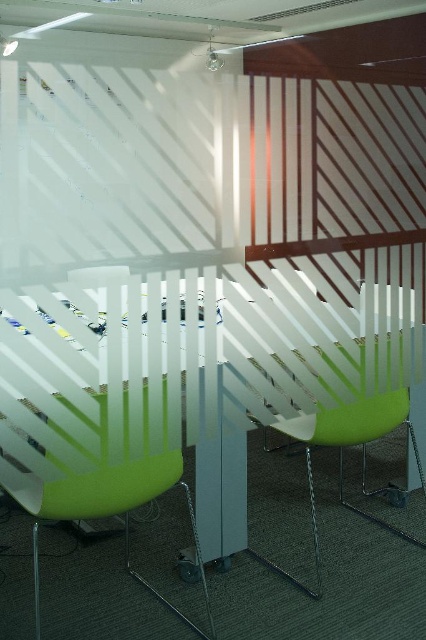
Is transparent plastic table at center to the right of green matte chair at center from the viewer's perspective?

Incorrect, transparent plastic table at center is not on the right side of green matte chair at center.

Image resolution: width=426 pixels, height=640 pixels. In order to click on transparent plastic table at center in this screenshot , I will do `click(187, 378)`.

Does transparent plastic table at center appear on the right side of matte green plastic chair at left?

Correct, you'll find transparent plastic table at center to the right of matte green plastic chair at left.

Does transparent plastic table at center have a lesser height compared to matte green plastic chair at left?

Indeed, transparent plastic table at center has a lesser height compared to matte green plastic chair at left.

Measure the distance between transparent plastic table at center and camera.

transparent plastic table at center is 1.46 meters from camera.

At what (x,y) coordinates should I click in order to perform the action: click on transparent plastic table at center. Please return your answer as a coordinate pair (x, y). This screenshot has height=640, width=426. Looking at the image, I should click on (187, 378).

Where is `matte green plastic chair at left`? matte green plastic chair at left is located at coordinates (112, 509).

Which is below, matte green plastic chair at left or green matte chair at center?

green matte chair at center

Locate an element on the screen. matte green plastic chair at left is located at coordinates (112, 509).